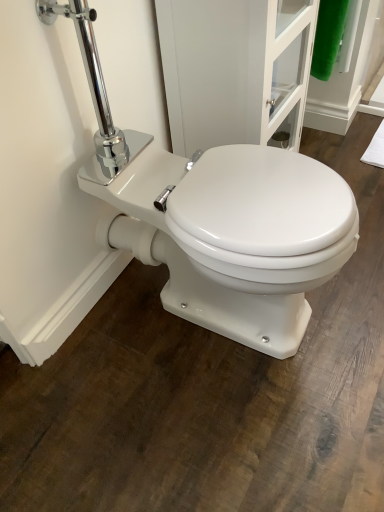
This screenshot has width=384, height=512. Find the location of `free space above white glossy toilet at center (from a real-world perspective)`. free space above white glossy toilet at center (from a real-world perspective) is located at coordinates (254, 190).